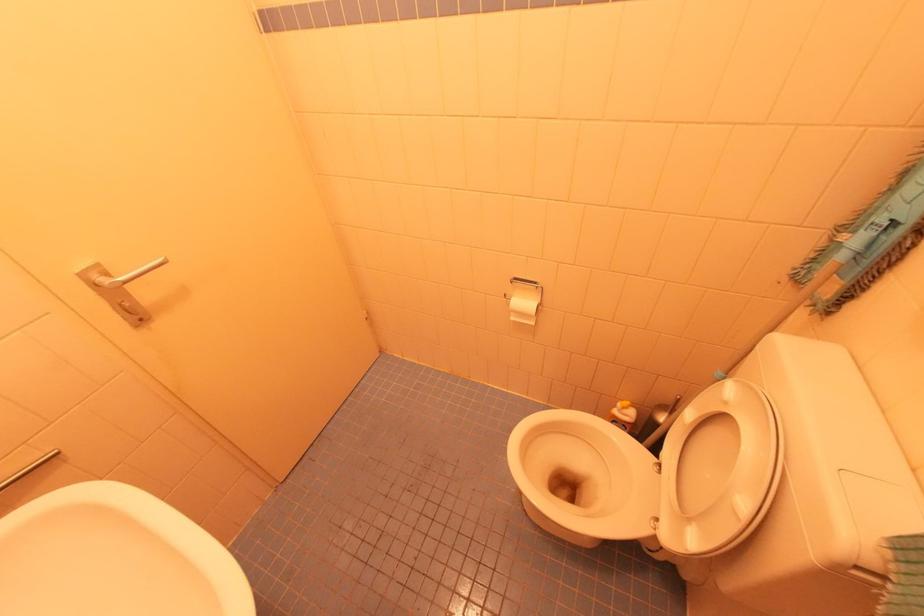
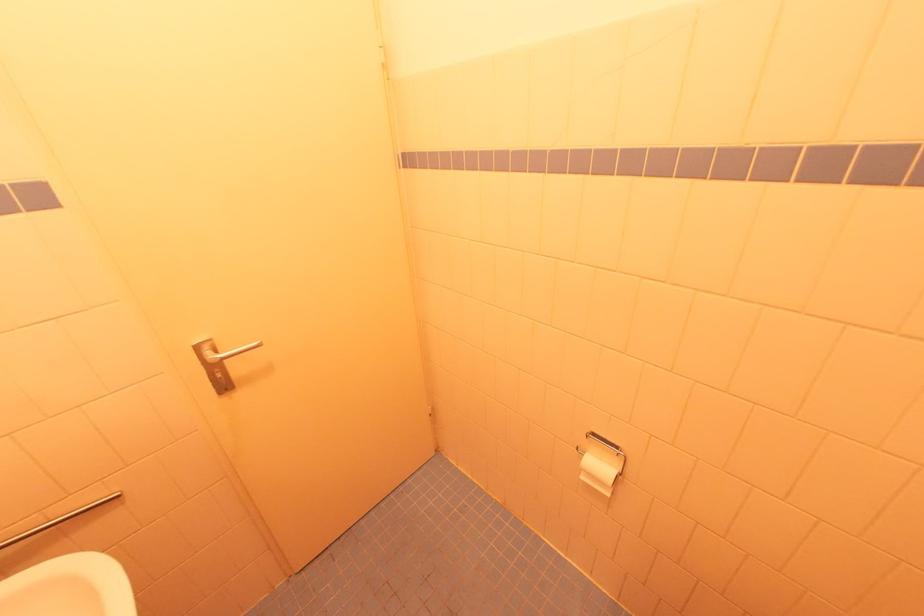
The point at [79,272] is marked in the first image. Where is the corresponding point in the second image?

(197, 345)